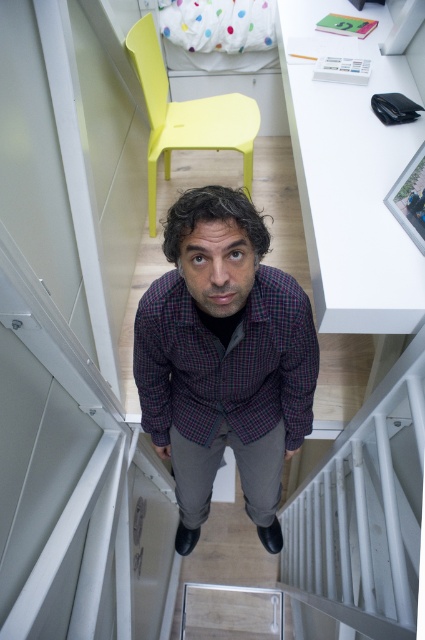
Looking at this image, who is higher up, plaid fabric shirt at center or yellow plastic chair at upper center?

yellow plastic chair at upper center is higher up.

Can you confirm if plaid fabric shirt at center is wider than yellow plastic chair at upper center?

Incorrect, plaid fabric shirt at center's width does not surpass yellow plastic chair at upper center's.

Identify the location of plaid fabric shirt at center. (223, 358).